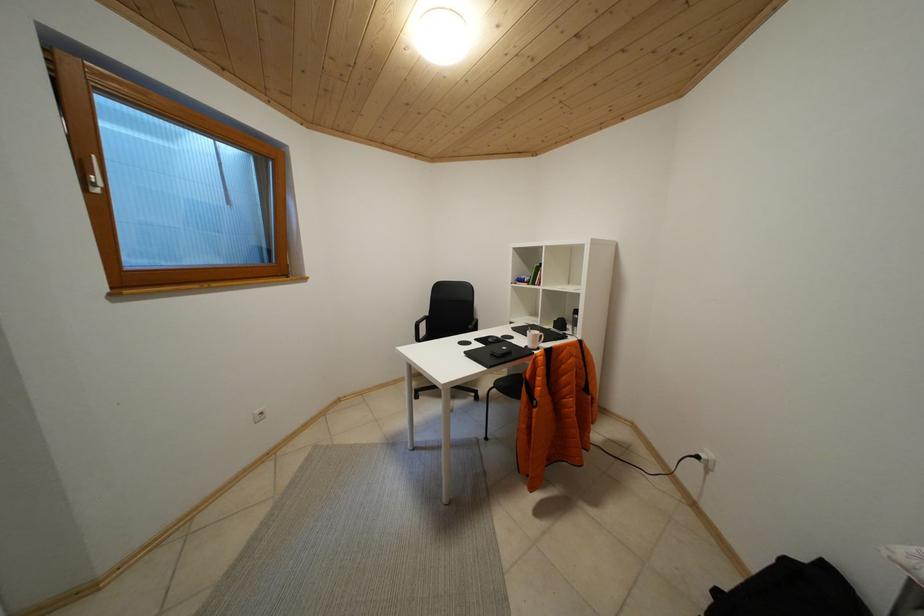
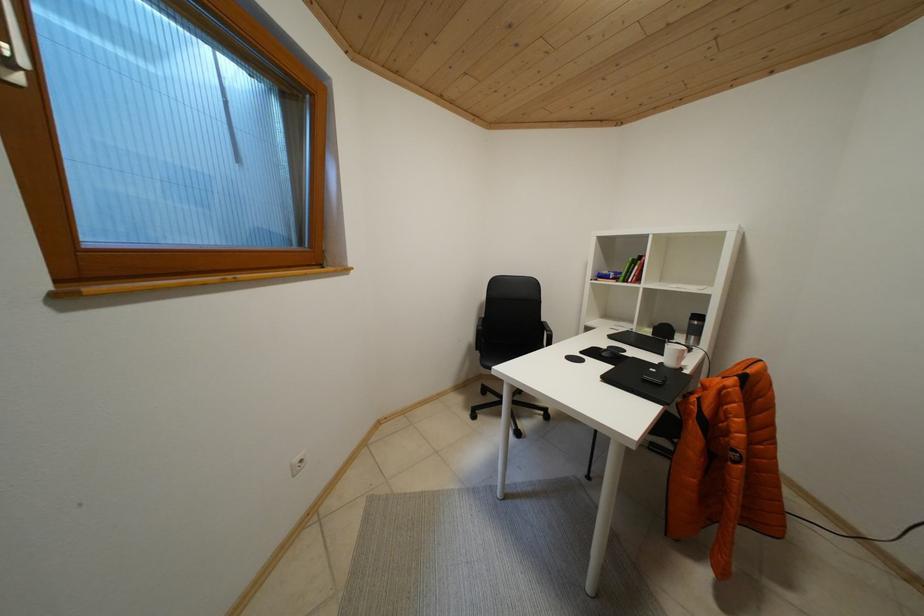
In a continuous first-person perspective shot, in which direction is the camera moving?

The cameraman walked toward left, forward.